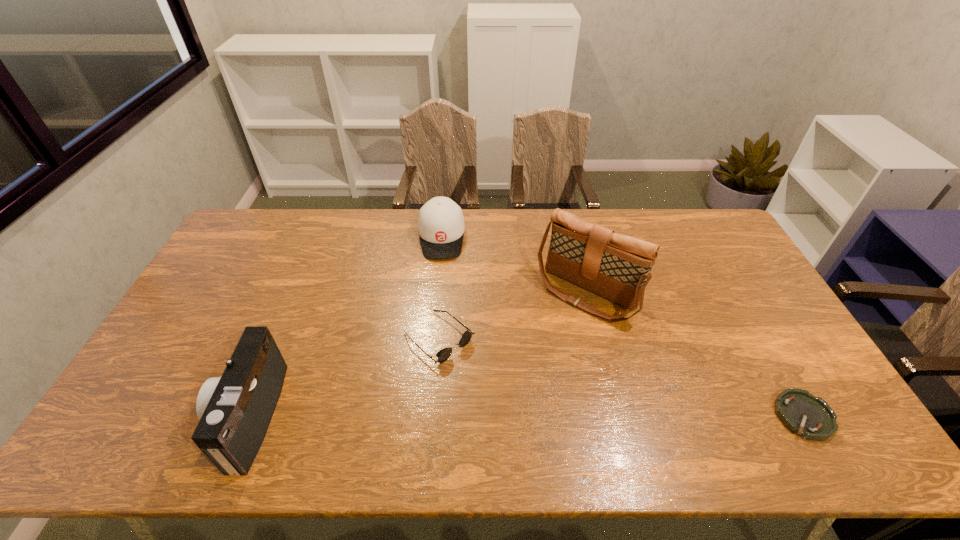
Where is `vacant area situated on the lens of the fourth shortest object`? The image size is (960, 540). vacant area situated on the lens of the fourth shortest object is located at coordinates (178, 416).

What are the coordinates of `vacant region located 0.200m on the lens of the fourth shortest object` in the screenshot? It's located at (141, 416).

Find the location of `free spot located on the left of the rightmost object`. free spot located on the left of the rightmost object is located at coordinates (732, 416).

Image resolution: width=960 pixels, height=540 pixels. What are the coordinates of `vacant region located on the front-facing side of the tallest object` in the screenshot? It's located at (550, 336).

In order to click on vacant space located on the front-facing side of the tallest object in this screenshot , I will do `click(500, 401)`.

What are the coordinates of `vacant point located on the front-facing side of the tallest object` in the screenshot? It's located at (489, 416).

At what (x,y) coordinates should I click in order to perform the action: click on vacant area situated on the front-facing side of the sunglasses. Please return your answer as a coordinate pair (x, y). Looking at the image, I should click on (484, 377).

Find the location of `vacant area located 0.160m on the front-facing side of the sunglasses`. vacant area located 0.160m on the front-facing side of the sunglasses is located at coordinates (506, 397).

At what (x,y) coordinates should I click in order to perform the action: click on vacant space positioned on the front-facing side of the sunglasses. Please return your answer as a coordinate pair (x, y). The width and height of the screenshot is (960, 540). Looking at the image, I should click on (492, 384).

Identify the location of free space located 0.180m on the front-facing side of the third tallest object. Image resolution: width=960 pixels, height=540 pixels. (441, 300).